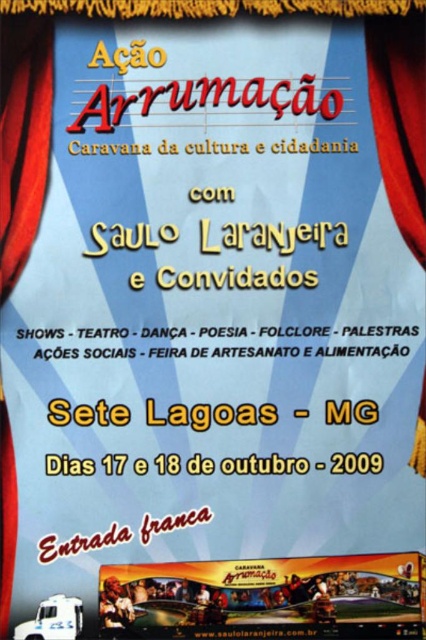
Measure the distance from yellow fabric banner at lower center to red velvet curtain at upper right.

yellow fabric banner at lower center and red velvet curtain at upper right are 2.03 meters apart.

Is yellow fabric banner at lower center closer to the viewer compared to red velvet curtain at upper right?

Yes.

Which is behind, point (235, 625) or point (382, 49)?

Positioned behind is point (382, 49).

Locate an element on the screen. The height and width of the screenshot is (640, 426). yellow fabric banner at lower center is located at coordinates (267, 596).

Is red velvet curtain at left further to camera compared to red velvet curtain at upper right?

No, it is in front of red velvet curtain at upper right.

Describe the element at coordinates (23, 138) in the screenshot. I see `red velvet curtain at left` at that location.

Find the location of a particular element. red velvet curtain at left is located at coordinates (23, 138).

Is yellow fabric banner at lower center further to camera compared to red velvet curtain at left?

No, it is not.

Find the location of a particular element. The image size is (426, 640). yellow fabric banner at lower center is located at coordinates (267, 596).

Is point (210, 570) farther from camera compared to point (31, 74)?

No, (210, 570) is in front of (31, 74).

At what (x,y) coordinates should I click in order to perform the action: click on yellow fabric banner at lower center. Please return your answer as a coordinate pair (x, y). Looking at the image, I should click on (267, 596).